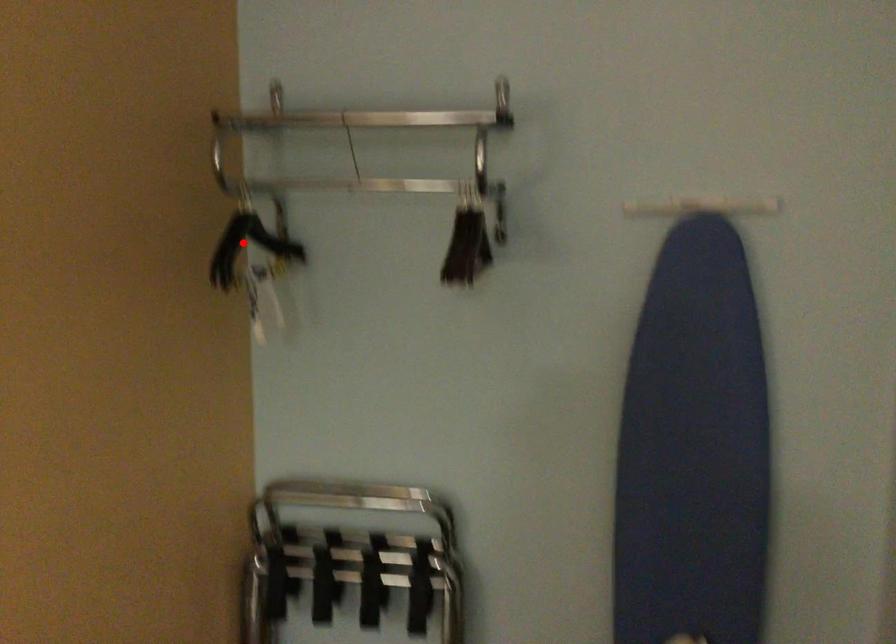
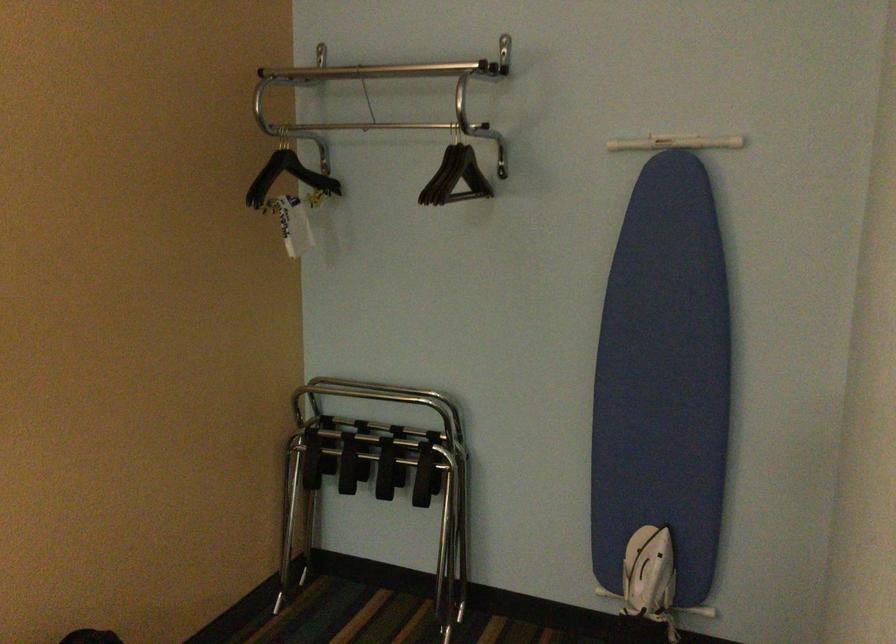
Where in the second image is the point corresponding to the highlighted location from the first image?

(288, 176)